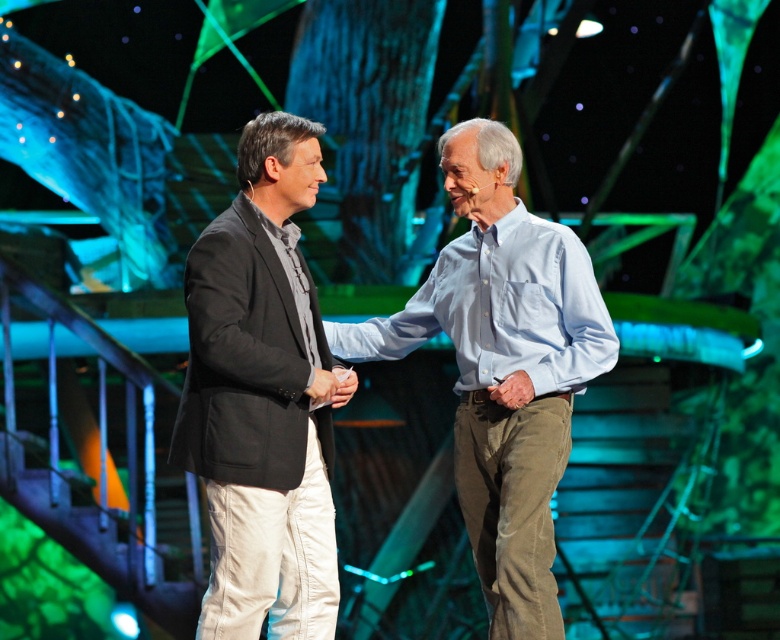
You are an event coordinator observing the stage setup. There are two people on stage wearing a matte black blazer at center and a light blue cotton shirt at center. Which one is positioned to the left?

The matte black blazer at center is to the left of the light blue cotton shirt at center, so the person wearing the matte black blazer at center is positioned to the left.

You are an event organizer who needs to ensure that the stage is wide enough for both the matte black blazer at center and the light blue cotton shirt at center to stand side by side without overlapping. Based on their widths, can they both fit comfortably on the stage if the stage is 2 meters wide?

The matte black blazer at center is narrower than the light blue cotton shirt at center. However, since the total width of both items combined is not provided, it is impossible to determine if they can fit comfortably on a 2 meter wide stage based solely on the given information.

You are a photographer positioned at the back of the stage. You want to take a photo of both the matte black blazer at center and the light blue cotton shirt at center so that they appear side by side in the frame. Given their current distance apart, can you capture both in a single shot without moving either subject?

The matte black blazer at center and light blue cotton shirt at center are 36.19 inches apart. Since they are positioned at the center of the stage and the photographer is at the back, it is feasible to capture both in a single shot as their separation allows for a wide enough angle to include both in the frame.